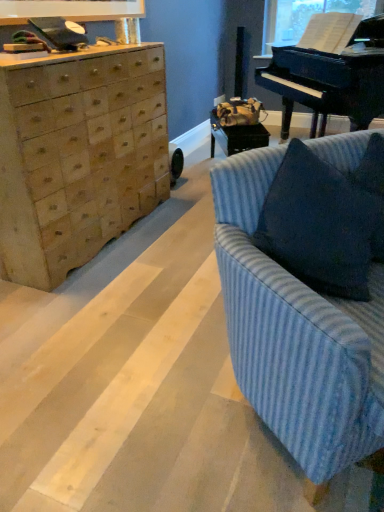
Question: Is blue textured pillow at right in contact with transparent plastic window screen at upper right?

Choices:
 (A) no
 (B) yes

Answer: (A)

Question: Does blue textured pillow at right have a smaller size compared to transparent plastic window screen at upper right?

Choices:
 (A) yes
 (B) no

Answer: (A)

Question: From the image's perspective, is blue textured pillow at right under transparent plastic window screen at upper right?

Choices:
 (A) no
 (B) yes

Answer: (B)

Question: From a real-world perspective, is blue textured pillow at right located beneath transparent plastic window screen at upper right?

Choices:
 (A) no
 (B) yes

Answer: (B)

Question: Is blue textured pillow at right thinner than transparent plastic window screen at upper right?

Choices:
 (A) no
 (B) yes

Answer: (A)

Question: Relative to blue striped fabric couch at right, is transparent plastic window screen at upper right in front or behind?

Choices:
 (A) front
 (B) behind

Answer: (B)

Question: Is transparent plastic window screen at upper right to the left or to the right of blue striped fabric couch at right in the image?

Choices:
 (A) right
 (B) left

Answer: (A)

Question: Is transparent plastic window screen at upper right taller or shorter than blue striped fabric couch at right?

Choices:
 (A) tall
 (B) short

Answer: (B)

Question: Considering the positions of transparent plastic window screen at upper right and blue striped fabric couch at right in the image, is transparent plastic window screen at upper right wider or thinner than blue striped fabric couch at right?

Choices:
 (A) thin
 (B) wide

Answer: (A)

Question: Is black polished piano at upper right bigger or smaller than blue striped fabric couch at right?

Choices:
 (A) small
 (B) big

Answer: (B)

Question: Is black polished piano at upper right in front of or behind blue striped fabric couch at right in the image?

Choices:
 (A) behind
 (B) front

Answer: (A)

Question: From a real-world perspective, is black polished piano at upper right positioned above or below blue striped fabric couch at right?

Choices:
 (A) below
 (B) above

Answer: (B)

Question: Considering the relative positions of black polished piano at upper right and blue striped fabric couch at right in the image provided, is black polished piano at upper right to the left or to the right of blue striped fabric couch at right?

Choices:
 (A) left
 (B) right

Answer: (B)

Question: From the image's perspective, is blue textured pillow at right above or below black polished piano at upper right?

Choices:
 (A) above
 (B) below

Answer: (B)

Question: Which is correct: blue textured pillow at right is inside black polished piano at upper right, or outside of it?

Choices:
 (A) outside
 (B) inside

Answer: (A)